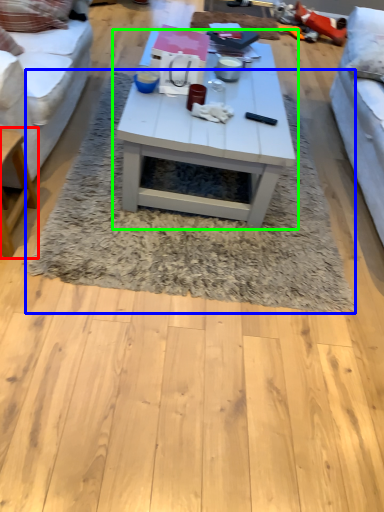
Question: Which object is the closest to the table (highlighted by a red box)? Choose among these: mat (highlighted by a blue box) or coffee table (highlighted by a green box).

Choices:
 (A) mat
 (B) coffee table

Answer: (A)